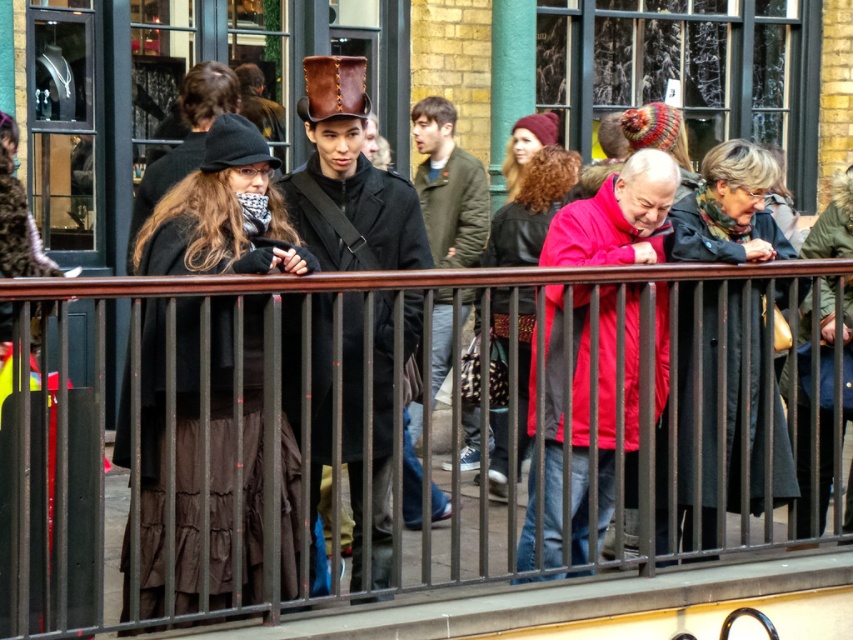
Can you confirm if red matte jacket at center is positioned to the left of dark gray wool coat at center?

Yes, red matte jacket at center is to the left of dark gray wool coat at center.

Can you confirm if red matte jacket at center is thinner than dark gray wool coat at center?

Yes.

Which is in front, point (624, 257) or point (656, 516)?

Point (624, 257) is in front.

Identify the location of red matte jacket at center. This screenshot has height=640, width=853. (577, 417).

Is brown metal fence at center bigger than green fuzzy coat at center?

Indeed, brown metal fence at center has a larger size compared to green fuzzy coat at center.

Can you confirm if brown metal fence at center is wider than green fuzzy coat at center?

Indeed, brown metal fence at center has a greater width compared to green fuzzy coat at center.

At what (x,y) coordinates should I click in order to perform the action: click on brown metal fence at center. Please return your answer as a coordinate pair (x, y). The height and width of the screenshot is (640, 853). Looking at the image, I should click on (340, 438).

Looking at this image, between brown metal fence at center and matte black coat at center, which one appears on the right side from the viewer's perspective?

brown metal fence at center

Is point (775, 406) positioned after point (192, 602)?

Yes, it is behind point (192, 602).

Is point (368, 468) closer to viewer compared to point (251, 442)?

That is True.

At what (x,y) coordinates should I click in order to perform the action: click on brown metal fence at center. Please return your answer as a coordinate pair (x, y). Looking at the image, I should click on (340, 438).